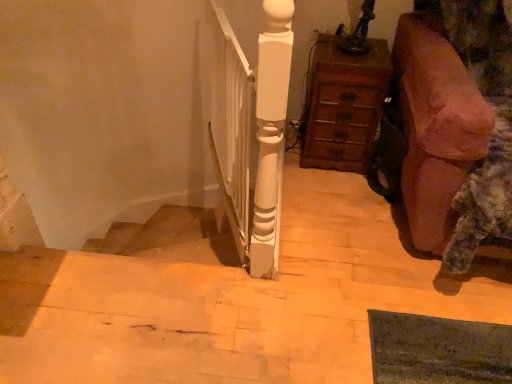
In order to face wooden chest of drawers at right, should I rotate leftwards or rightwards?

Turn right by 11.371 degrees to look at wooden chest of drawers at right.

The width and height of the screenshot is (512, 384). I want to click on brown fabric couch at right, so click(x=436, y=127).

This screenshot has height=384, width=512. Identify the location of wooden chest of drawers at right. point(343,105).

Between white glossy wooden post at center and brown fabric couch at right, which one is positioned behind?

white glossy wooden post at center is more distant.

Could you tell me if white glossy wooden post at center is turned towards brown fabric couch at right?

No, white glossy wooden post at center does not turn towards brown fabric couch at right.

Can you tell me how much white glossy wooden post at center and brown fabric couch at right differ in facing direction?

The angle between the facing direction of white glossy wooden post at center and the facing direction of brown fabric couch at right is 70.2 degrees.

Are white glossy wooden post at center and brown fabric couch at right located far from each other?

No, white glossy wooden post at center is in close proximity to brown fabric couch at right.

Can you confirm if wooden chest of drawers at right is positioned to the left of white glossy wooden post at center?

No.

From the picture: Is wooden chest of drawers at right facing towards white glossy wooden post at center?

No, wooden chest of drawers at right does not turn towards white glossy wooden post at center.

Does brown fabric couch at right come behind wooden chest of drawers at right?

No, it is not.

Can we say brown fabric couch at right lies outside wooden chest of drawers at right?

Yes, brown fabric couch at right is not within wooden chest of drawers at right.

Consider the image. Which is more to the left, brown fabric couch at right or wooden chest of drawers at right?

wooden chest of drawers at right is more to the left.

From the image's perspective, is brown fabric couch at right located above or below wooden chest of drawers at right?

Clearly, from the image's perspective, brown fabric couch at right is below wooden chest of drawers at right.

Considering their positions, is white glossy wooden post at center located in front of or behind wooden chest of drawers at right?

Clearly, white glossy wooden post at center is in front of wooden chest of drawers at right.

Is white glossy wooden post at center thinner than wooden chest of drawers at right?

Correct, the width of white glossy wooden post at center is less than that of wooden chest of drawers at right.

Consider the image. Is white glossy wooden post at center positioned far away from wooden chest of drawers at right?

No, white glossy wooden post at center is not far from wooden chest of drawers at right.

Measure the distance from brown fabric couch at right to white glossy wooden post at center.

A distance of 24.18 inches exists between brown fabric couch at right and white glossy wooden post at center.

Is point (453, 219) farther from camera compared to point (264, 131)?

That is True.

Does brown fabric couch at right have a greater width compared to white glossy wooden post at center?

Correct, the width of brown fabric couch at right exceeds that of white glossy wooden post at center.

Consider the image. Between brown fabric couch at right and white glossy wooden post at center, which one has larger size?

Bigger between the two is brown fabric couch at right.

Is brown fabric couch at right completely or partially inside wooden chest of drawers at right?

That's incorrect, brown fabric couch at right is not inside wooden chest of drawers at right.

In the image, there is a brown fabric couch at right. Where is `the chest of drawers above it (from the image's perspective)`? The width and height of the screenshot is (512, 384). the chest of drawers above it (from the image's perspective) is located at coordinates (343, 105).

Locate an element on the screen. furniture to the right of white glossy wooden post at center is located at coordinates (436, 127).

Where is `the chest of drawers beneath the white glossy wooden post at center (from a real-world perspective)`? This screenshot has width=512, height=384. the chest of drawers beneath the white glossy wooden post at center (from a real-world perspective) is located at coordinates 343,105.

Estimate the real-world distances between objects in this image. Which object is further from brown fabric couch at right, wooden chest of drawers at right or white glossy wooden post at center?

white glossy wooden post at center.

From the image, which object appears to be nearer to brown fabric couch at right, white glossy wooden post at center or wooden chest of drawers at right?

Result: wooden chest of drawers at right is closer to brown fabric couch at right.

When comparing their distances from wooden chest of drawers at right, does white glossy wooden post at center or brown fabric couch at right seem further?

Among the two, white glossy wooden post at center is located further to wooden chest of drawers at right.

Looking at this image, based on their spatial positions, is brown fabric couch at right or wooden chest of drawers at right closer to white glossy wooden post at center?

wooden chest of drawers at right is positioned closer to the anchor white glossy wooden post at center.

Looking at the image, which one is located closer to white glossy wooden post at center, wooden chest of drawers at right or brown fabric couch at right?

Among the two, wooden chest of drawers at right is located nearer to white glossy wooden post at center.

Based on their spatial positions, is brown fabric couch at right or white glossy wooden post at center further from wooden chest of drawers at right?

white glossy wooden post at center is further to wooden chest of drawers at right.

The height and width of the screenshot is (384, 512). I want to click on the chest of drawers located between white glossy wooden post at center and brown fabric couch at right in the left-right direction, so click(x=343, y=105).